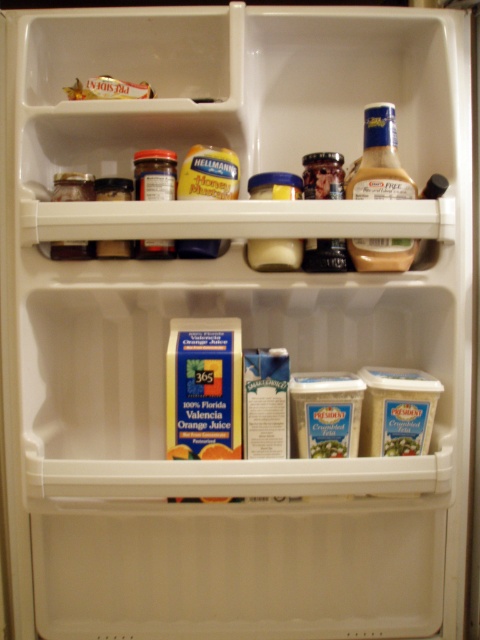
Measure the distance between translucent plastic mustard at upper right and gold foil packet at upper left.

translucent plastic mustard at upper right and gold foil packet at upper left are 12.52 inches apart from each other.

Does translucent plastic mustard at upper right have a lesser height compared to gold foil packet at upper left?

In fact, translucent plastic mustard at upper right may be taller than gold foil packet at upper left.

Looking at this image, who is more forward, (387, 246) or (135, 90)?

Point (387, 246) is more forward.

Identify the location of translucent plastic mustard at upper right. (380, 160).